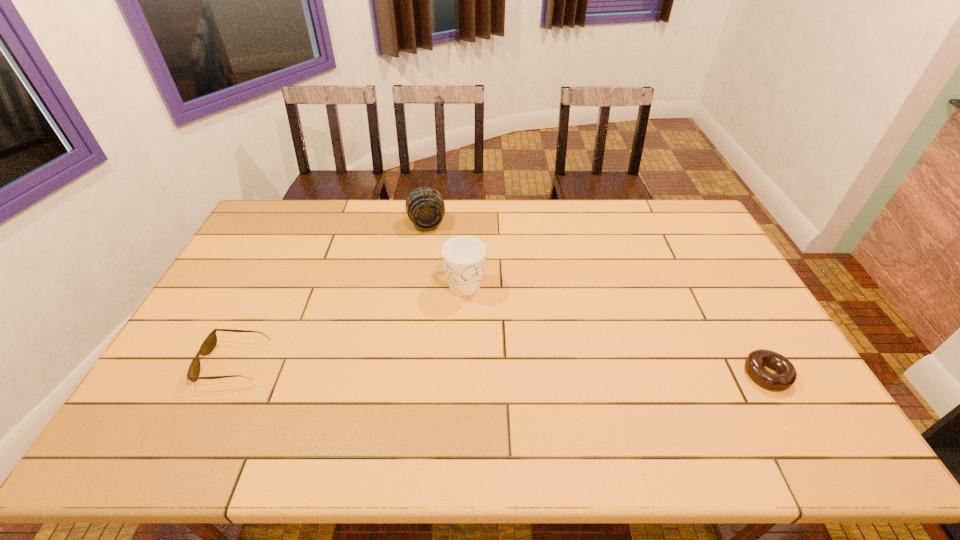
The width and height of the screenshot is (960, 540). Identify the location of free space on the desktop that is between the sunglasses and the doughnut and is positioned on the side of the second farthest object with the handle. (522, 369).

Where is `free space on the desktop that is between the sunglasses and the doughnut and is positioned at the front element of the telephoto lens`? free space on the desktop that is between the sunglasses and the doughnut and is positioned at the front element of the telephoto lens is located at coordinates (458, 368).